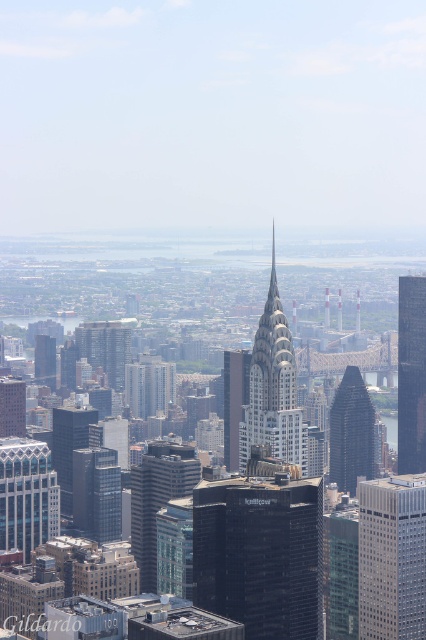
Who is positioned more to the right, matte glass skyscraper at center-left or shiny glass skyscraper at left?

Positioned to the right is matte glass skyscraper at center-left.

Consider the image. Who is positioned more to the left, matte glass skyscraper at center-left or shiny glass skyscraper at left?

shiny glass skyscraper at left is more to the left.

The width and height of the screenshot is (426, 640). Find the location of `matte glass skyscraper at center-left`. matte glass skyscraper at center-left is located at coordinates (104, 348).

Is point (11, 528) in front of point (170, 493)?

No, (11, 528) is further to viewer.

Can you confirm if glassy white skyscraper at left is positioned above glassy teal skyscraper at center-left?

Yes.

What do you see at coordinates (26, 493) in the screenshot? I see `glassy white skyscraper at left` at bounding box center [26, 493].

The width and height of the screenshot is (426, 640). What are the coordinates of `glassy white skyscraper at left` in the screenshot? It's located at click(x=26, y=493).

Does point (405, 577) come behind point (154, 564)?

Yes, it is.

Does point (417, 500) come closer to viewer compared to point (176, 480)?

No, it is not.

Is point (388, 481) positioned behind point (140, 532)?

Yes, point (388, 481) is farther from viewer.

Find the location of a particular element. white glass skyscraper at center is located at coordinates (391, 557).